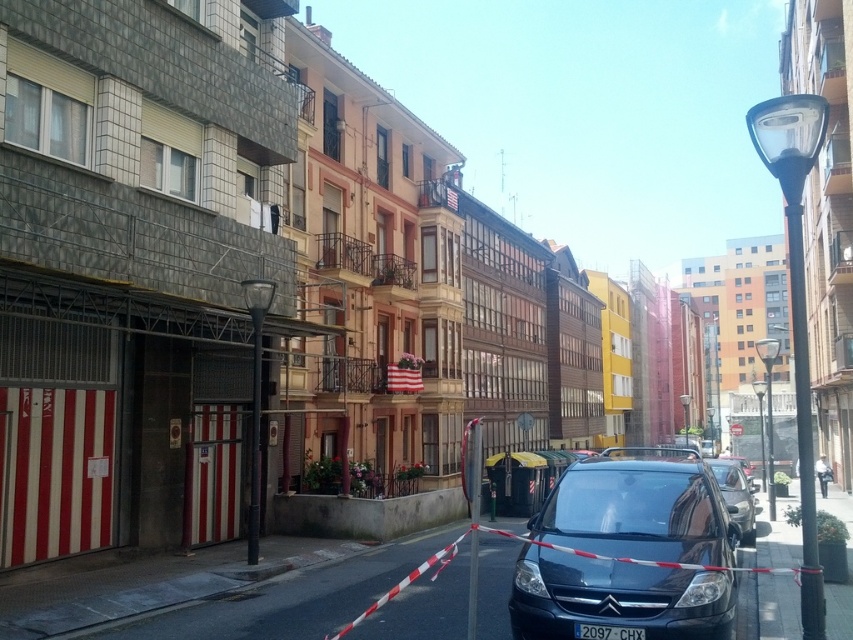
Can you confirm if shiny black car at center is taller than black plastic license plate at center?

Correct, shiny black car at center is much taller as black plastic license plate at center.

Is point (737, 483) farther from camera compared to point (573, 630)?

That is True.

The width and height of the screenshot is (853, 640). What do you see at coordinates (735, 497) in the screenshot?
I see `shiny black car at center` at bounding box center [735, 497].

You are a GUI agent. You are given a task and a screenshot of the screen. Output one action in this format:
    pyautogui.click(x=<x>, y=<y>)
    Task: Click on the shiny black car at center
    
    Given the screenshot: What is the action you would take?
    point(735,497)

Is the position of shiny blue car at center less distant than that of black plastic license plate at center?

Yes.

In the scene shown: Which is above, shiny blue car at center or black plastic license plate at center?

black plastic license plate at center is above.

Locate an element on the screen. shiny blue car at center is located at coordinates (639, 509).

The height and width of the screenshot is (640, 853). Describe the element at coordinates (639, 509) in the screenshot. I see `shiny blue car at center` at that location.

Is point (614, 577) farther from viewer compared to point (750, 515)?

No, it is in front of (750, 515).

Find the location of a particular element. The image size is (853, 640). shiny blue car at center is located at coordinates (639, 509).